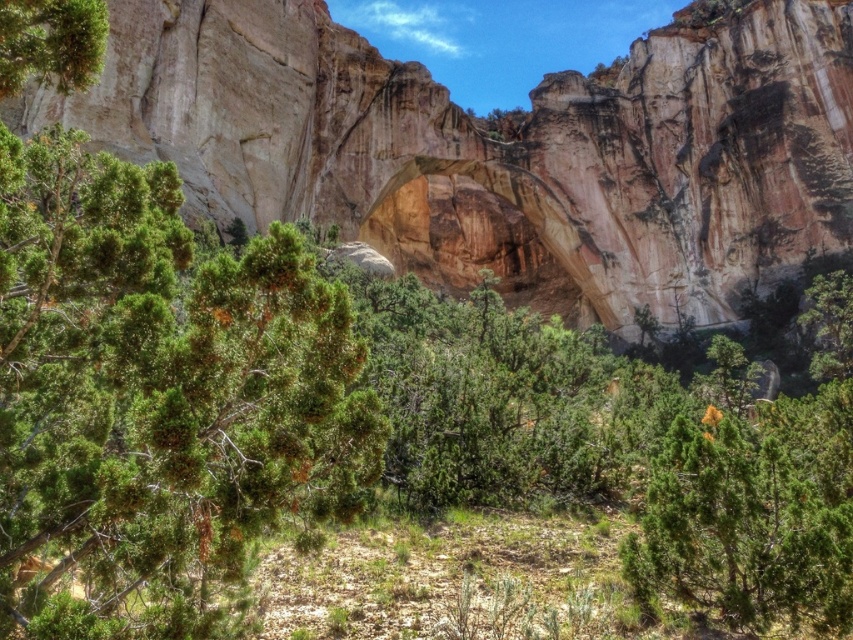
Does green needle-like at center appear on the left side of green matte tree at center?

Yes, green needle-like at center is to the left of green matte tree at center.

Is green needle-like at center shorter than green matte tree at center?

In fact, green needle-like at center may be taller than green matte tree at center.

You are a GUI agent. You are given a task and a screenshot of the screen. Output one action in this format:
    pyautogui.click(x=<x>, y=<y>)
    Task: Click on the green needle-like at center
    
    Given the screenshot: What is the action you would take?
    pyautogui.click(x=157, y=397)

In order to click on green needle-like at center in this screenshot , I will do `click(157, 397)`.

Which of these two, rustic sandstone arch at center or green textured pine tree at upper left, stands taller?

rustic sandstone arch at center is taller.

You are a GUI agent. You are given a task and a screenshot of the screen. Output one action in this format:
    pyautogui.click(x=<x>, y=<y>)
    Task: Click on the rustic sandstone arch at center
    Image resolution: width=853 pixels, height=640 pixels.
    Given the screenshot: What is the action you would take?
    pyautogui.click(x=500, y=148)

Can you confirm if green needle-like at center is thinner than green textured pine tree at upper left?

In fact, green needle-like at center might be wider than green textured pine tree at upper left.

In the scene shown: Between green needle-like at center and green textured pine tree at upper left, which one appears on the right side from the viewer's perspective?

green needle-like at center is more to the right.

Where is `green needle-like at center`? This screenshot has height=640, width=853. green needle-like at center is located at coordinates (157, 397).